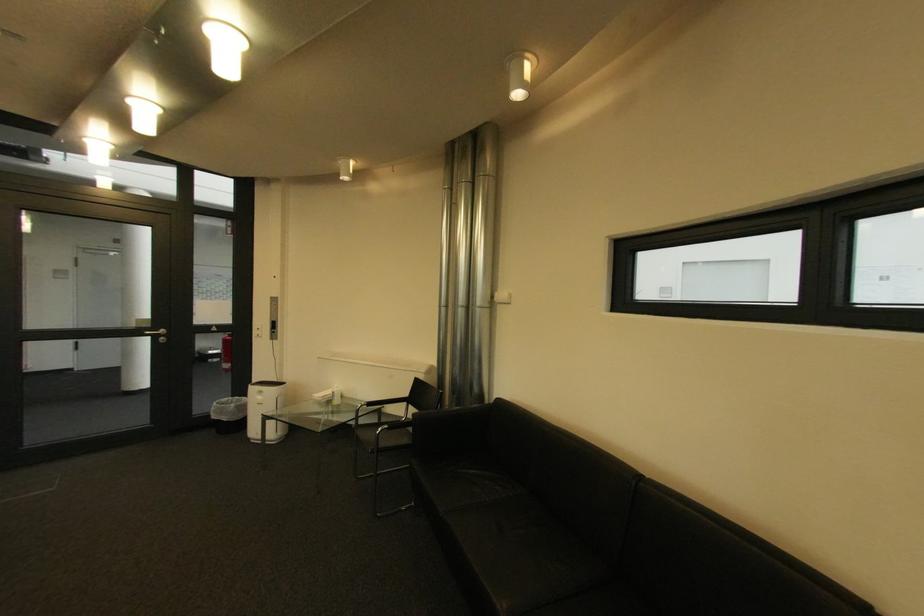
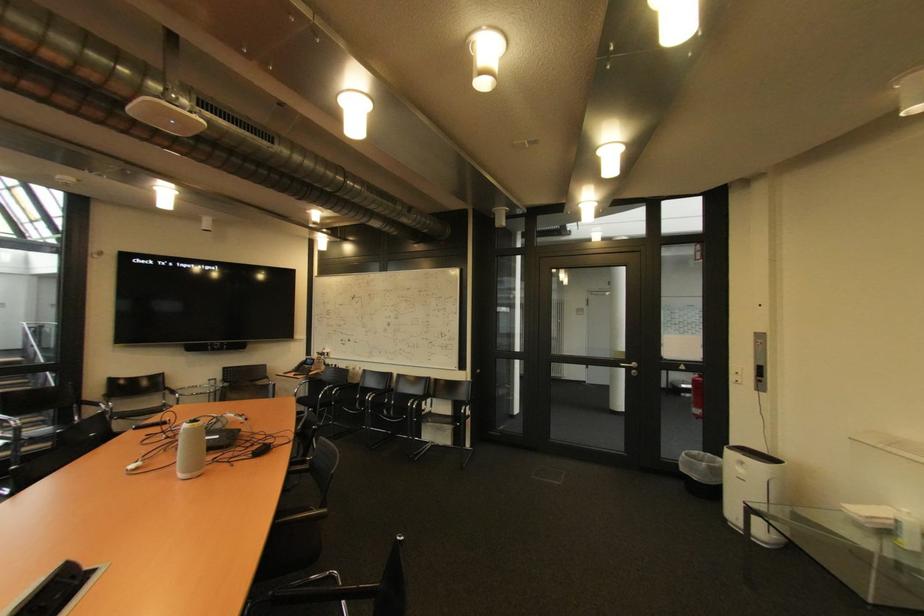
In the second image, find the point that corresponds to point 280,299 in the first image.

(763, 334)